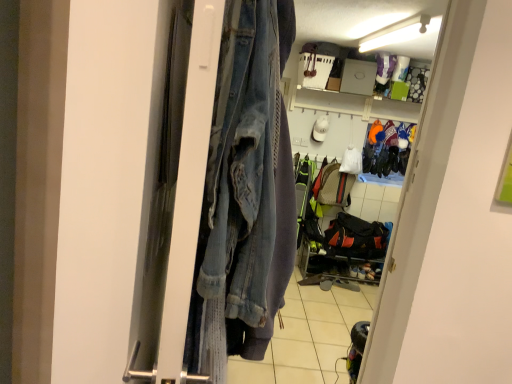
Describe the element at coordinates (176, 199) in the screenshot. The width and height of the screenshot is (512, 384). I see `metallic silver screen door at center` at that location.

Identify the location of metallic silver screen door at center. coord(176,199).

Measure the distance between metallic silver screen door at center and camera.

26.04 inches.

Identify the location of metallic silver screen door at center. (176, 199).